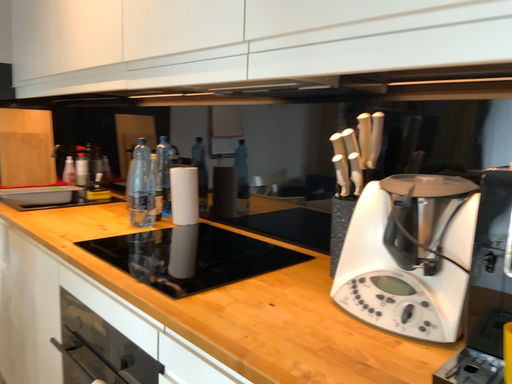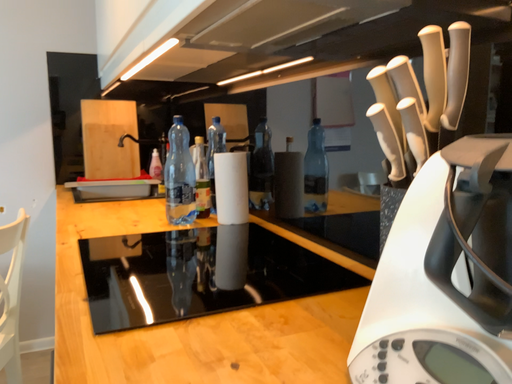
Question: How did the camera likely rotate when shooting the video?

Choices:
 (A) rotated right
 (B) rotated left

Answer: (B)